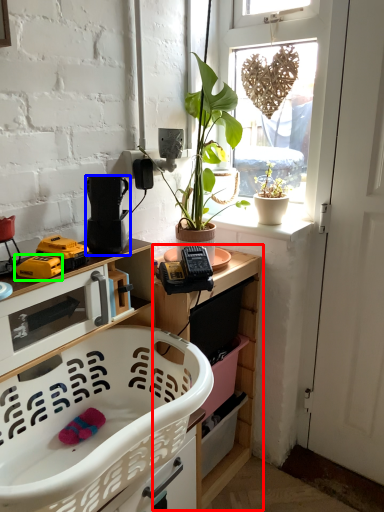
Question: Which object is positioned closest to shelf (highlighted by a red box)? Select from appliance (highlighted by a blue box) and toy (highlighted by a green box).

Choices:
 (A) appliance
 (B) toy

Answer: (A)